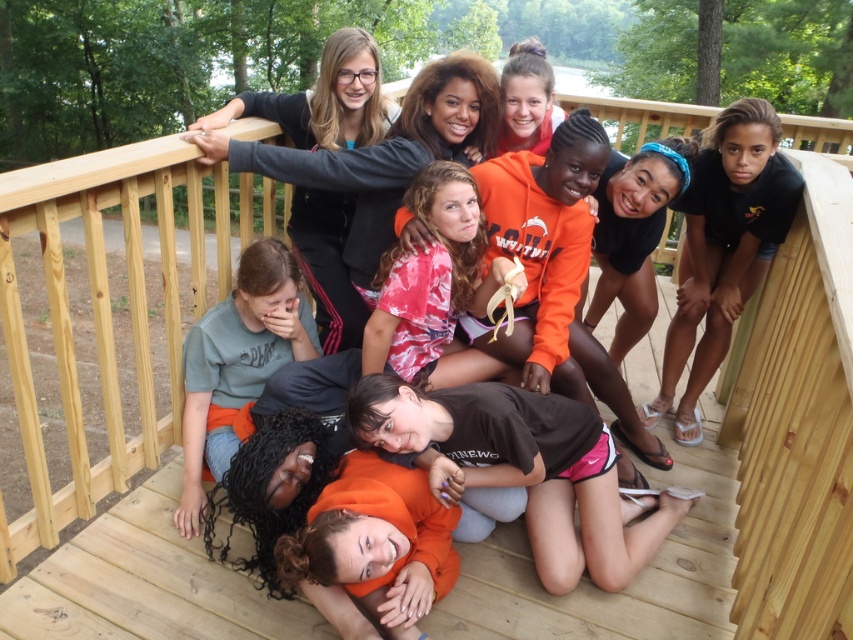
Question: Is green cotton shirt at lower left thinner than matte black jacket at upper center?

Choices:
 (A) yes
 (B) no

Answer: (A)

Question: Which object appears closest to the camera in this image?

Choices:
 (A) matte black jacket at upper center
 (B) black matte shirt at upper right

Answer: (A)

Question: Can you confirm if black matte shirt at upper right is positioned above green cotton shirt at lower left?

Choices:
 (A) no
 (B) yes

Answer: (B)

Question: Considering the relative positions of green cotton shirt at lower left and matte black jacket at upper center in the image provided, where is green cotton shirt at lower left located with respect to matte black jacket at upper center?

Choices:
 (A) left
 (B) right

Answer: (A)

Question: Which object appears closest to the camera in this image?

Choices:
 (A) matte black jacket at upper center
 (B) black matte shirt at upper right

Answer: (A)

Question: Considering the real-world distances, which object is closest to the green cotton shirt at lower left?

Choices:
 (A) black matte shirt at upper right
 (B) orange fleece sweatshirt at center

Answer: (B)